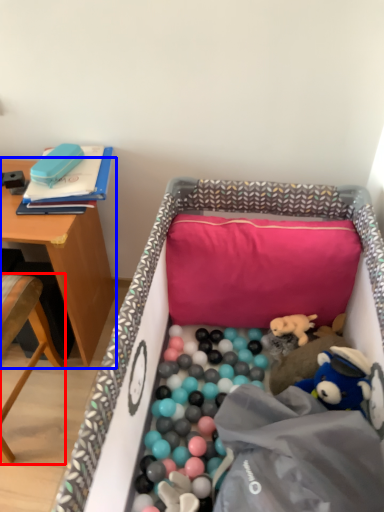
Question: Which object is further to the camera taking this photo, chair (highlighted by a red box) or table (highlighted by a blue box)?

Choices:
 (A) chair
 (B) table

Answer: (B)